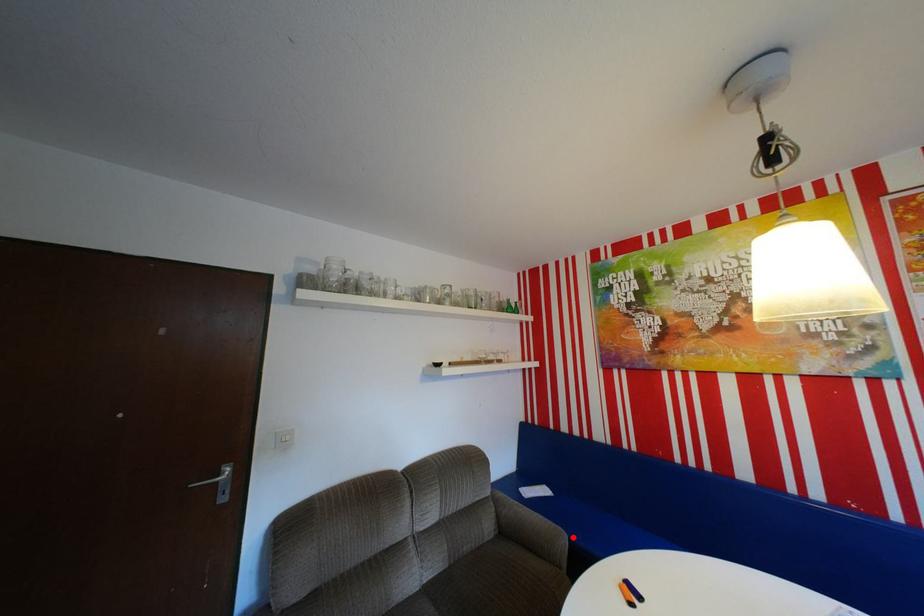
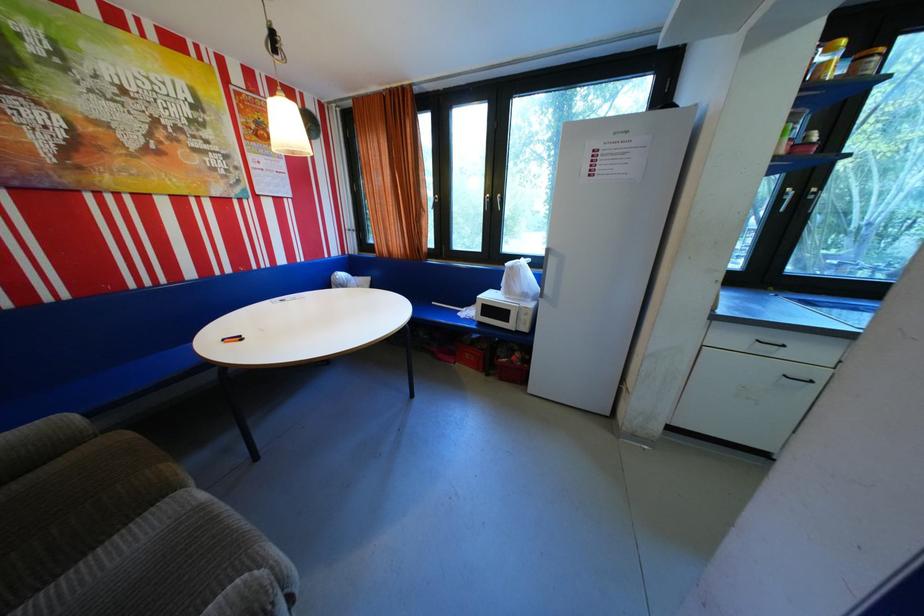
In the second image, find the point that corresponds to the highlighted location in the first image.

(79, 418)